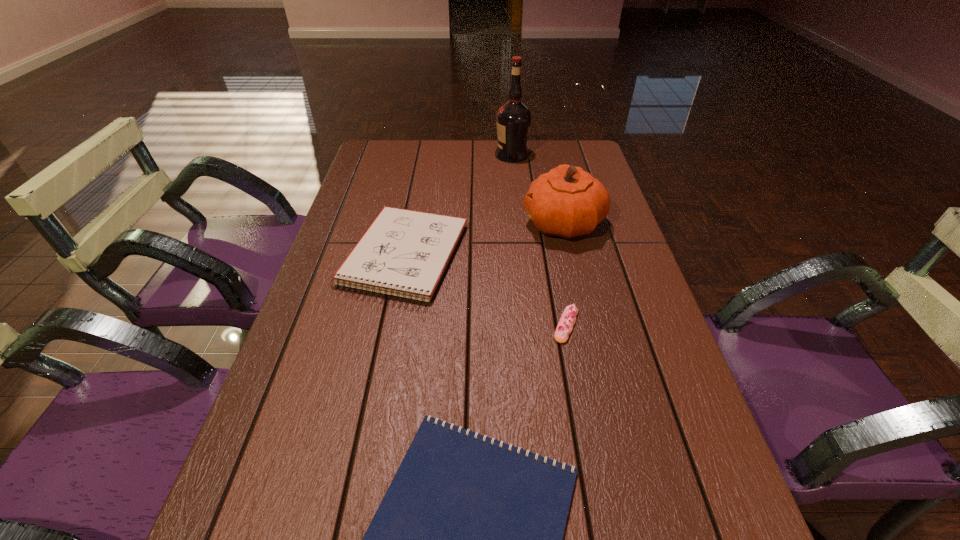
Locate an element on the screen. vacant region at the far left corner is located at coordinates (404, 147).

Locate an element on the screen. The width and height of the screenshot is (960, 540). blank space at the far right corner is located at coordinates (571, 143).

The width and height of the screenshot is (960, 540). I want to click on vacant space that's between the eclair and the taller notepad, so click(486, 291).

You are a GUI agent. You are given a task and a screenshot of the screen. Output one action in this format:
    pyautogui.click(x=<x>, y=<y>)
    Task: Click on the free space that is in between the second tallest object and the second shortest object
    
    Given the screenshot: What is the action you would take?
    pyautogui.click(x=564, y=274)

Find the location of `vacant region between the farthest object and the second shortest object`. vacant region between the farthest object and the second shortest object is located at coordinates (539, 240).

Identify the location of empty location between the liquor and the eclair. The height and width of the screenshot is (540, 960). (539, 240).

Locate an element on the screen. Image resolution: width=960 pixels, height=540 pixels. the closest object to the shorter notepad is located at coordinates (565, 325).

Image resolution: width=960 pixels, height=540 pixels. Identify the location of object that is the third closest to the shorter notepad. click(566, 202).